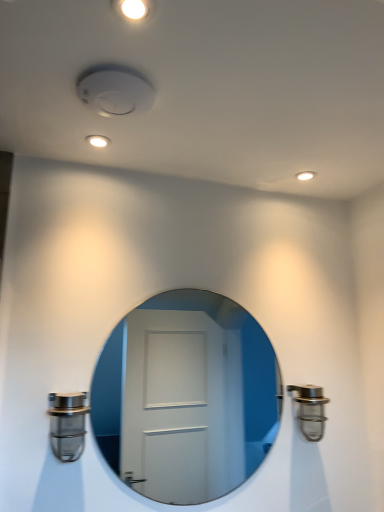
This screenshot has width=384, height=512. Describe the element at coordinates (67, 424) in the screenshot. I see `satin nickel door handle at lower left, the 1th door handle from the front` at that location.

Measure the distance between point (x=327, y=401) and camera.

The depth of point (x=327, y=401) is 5.28 feet.

The height and width of the screenshot is (512, 384). I want to click on satin nickel faucet at right, the second door handle positioned from the left, so click(x=310, y=410).

What do you see at coordinates (185, 397) in the screenshot? Image resolution: width=384 pixels, height=512 pixels. I see `white glossy mirror at center` at bounding box center [185, 397].

The width and height of the screenshot is (384, 512). Find the location of `satin nickel door handle at lower left, which is counted as the second door handle, starting from the right`. satin nickel door handle at lower left, which is counted as the second door handle, starting from the right is located at coordinates click(x=67, y=424).

Considering their positions, is satin nickel faucet at right, the 1th door handle viewed from the back, located in front of or behind white glossy mirror at center?

In the image, satin nickel faucet at right, the 1th door handle viewed from the back, appears behind white glossy mirror at center.

From the image's perspective, which one is positioned lower, satin nickel faucet at right, the second door handle in the front-to-back sequence, or white glossy mirror at center?

satin nickel faucet at right, the second door handle in the front-to-back sequence, from the image's perspective.

Is satin nickel faucet at right, the first door handle from the right, facing towards white glossy mirror at center?

No, satin nickel faucet at right, the first door handle from the right, does not turn towards white glossy mirror at center.

In terms of size, does satin nickel faucet at right, the second door handle in the front-to-back sequence, appear bigger or smaller than white glossy mirror at center?

In the image, satin nickel faucet at right, the second door handle in the front-to-back sequence, appears to be smaller than white glossy mirror at center.

Locate an element on the screen. door handle above the satin nickel faucet at right, the first door handle from the right (from a real-world perspective) is located at coordinates (67, 424).

Which is nearer, [301,403] or [72,394]?

Point [301,403] appears to be farther away from the viewer than point [72,394].

Does satin nickel faucet at right, the second door handle positioned from the left, have a lesser height compared to satin nickel door handle at lower left, arranged as the 2th door handle when viewed from the back?

In fact, satin nickel faucet at right, the second door handle positioned from the left, may be taller than satin nickel door handle at lower left, arranged as the 2th door handle when viewed from the back.

Is satin nickel faucet at right, the 1th door handle viewed from the back, looking in the opposite direction of satin nickel door handle at lower left, which is counted as the second door handle, starting from the right?

No, satin nickel door handle at lower left, which is counted as the second door handle, starting from the right, is not at the back of satin nickel faucet at right, the 1th door handle viewed from the back.

Are satin nickel door handle at lower left, the 1th door handle in the left-to-right sequence, and white glossy mirror at center far apart?

Yes, satin nickel door handle at lower left, the 1th door handle in the left-to-right sequence, and white glossy mirror at center are located far from each other.

Considering the positions of objects satin nickel door handle at lower left, the 1th door handle in the left-to-right sequence, and white glossy mirror at center in the image provided, who is more to the right, satin nickel door handle at lower left, the 1th door handle in the left-to-right sequence, or white glossy mirror at center?

white glossy mirror at center.

Is satin nickel door handle at lower left, arranged as the 2th door handle when viewed from the back, turned away from white glossy mirror at center?

No.

From the image's perspective, which object appears higher, satin nickel door handle at lower left, arranged as the 2th door handle when viewed from the back, or white glossy mirror at center?

white glossy mirror at center, from the image's perspective.

Does white glossy mirror at center lie in front of satin nickel door handle at lower left, the 1th door handle from the front?

No, it is not.

Between white glossy mirror at center and satin nickel door handle at lower left, the 1th door handle in the left-to-right sequence, which one appears on the right side from the viewer's perspective?

white glossy mirror at center.

Could you tell me if white glossy mirror at center is turned towards satin nickel door handle at lower left, the 1th door handle in the left-to-right sequence?

No, white glossy mirror at center does not turn towards satin nickel door handle at lower left, the 1th door handle in the left-to-right sequence.

What's the angular difference between white glossy mirror at center and satin nickel door handle at lower left, which is counted as the second door handle, starting from the right,'s facing directions?

0.792 degrees separate the facing orientations of white glossy mirror at center and satin nickel door handle at lower left, which is counted as the second door handle, starting from the right.

Choose the correct answer: Is white glossy mirror at center inside satin nickel faucet at right, the 1th door handle viewed from the back, or outside it?

white glossy mirror at center exists outside the volume of satin nickel faucet at right, the 1th door handle viewed from the back.

How much distance is there between white glossy mirror at center and satin nickel faucet at right, the first door handle from the right?

white glossy mirror at center is 1.54 meters from satin nickel faucet at right, the first door handle from the right.

Considering the relative positions of white glossy mirror at center and satin nickel faucet at right, the second door handle in the front-to-back sequence, in the image provided, is white glossy mirror at center to the right of satin nickel faucet at right, the second door handle in the front-to-back sequence, from the viewer's perspective?

Incorrect, white glossy mirror at center is not on the right side of satin nickel faucet at right, the second door handle in the front-to-back sequence.

From the image's perspective, between white glossy mirror at center and satin nickel faucet at right, the second door handle in the front-to-back sequence, who is located below?

satin nickel faucet at right, the second door handle in the front-to-back sequence.

Is satin nickel door handle at lower left, which is counted as the second door handle, starting from the right, further to the viewer compared to satin nickel faucet at right, the 1th door handle viewed from the back?

No, satin nickel door handle at lower left, which is counted as the second door handle, starting from the right, is closer to the viewer.

From the image's perspective, is satin nickel door handle at lower left, arranged as the 2th door handle when viewed from the back, located above or below satin nickel faucet at right, the 1th door handle viewed from the back?

Based on their image positions, satin nickel door handle at lower left, arranged as the 2th door handle when viewed from the back, is located above satin nickel faucet at right, the 1th door handle viewed from the back.

Measure the distance from satin nickel door handle at lower left, which is counted as the second door handle, starting from the right, to satin nickel faucet at right, the second door handle positioned from the left.

The distance of satin nickel door handle at lower left, which is counted as the second door handle, starting from the right, from satin nickel faucet at right, the second door handle positioned from the left, is 31.08 inches.

From a real-world perspective, starting from the white glossy mirror at center, which door handle is the 2nd one below it? Please provide its 2D coordinates.

[(310, 410)]

What are the coordinates of `door handle below the satin nickel door handle at lower left, the 1th door handle in the left-to-right sequence (from the image's perspective)` in the screenshot? It's located at (310, 410).

In the scene shown: Considering their positions, is satin nickel door handle at lower left, which is counted as the second door handle, starting from the right, positioned closer to white glossy mirror at center than satin nickel faucet at right, the first door handle from the right?

Among the two, satin nickel faucet at right, the first door handle from the right, is located nearer to white glossy mirror at center.

Which object lies nearer to the anchor point satin nickel faucet at right, the second door handle positioned from the left, satin nickel door handle at lower left, arranged as the 2th door handle when viewed from the back, or white glossy mirror at center?

Among the two, satin nickel door handle at lower left, arranged as the 2th door handle when viewed from the back, is located nearer to satin nickel faucet at right, the second door handle positioned from the left.

From the image, which object appears to be nearer to satin nickel faucet at right, the second door handle positioned from the left, white glossy mirror at center or satin nickel door handle at lower left, the 1th door handle in the left-to-right sequence?

satin nickel door handle at lower left, the 1th door handle in the left-to-right sequence, lies closer to satin nickel faucet at right, the second door handle positioned from the left, than the other object.

Based on their spatial positions, is satin nickel faucet at right, the first door handle from the right, or satin nickel door handle at lower left, the 1th door handle in the left-to-right sequence, further from white glossy mirror at center?

The object further to white glossy mirror at center is satin nickel door handle at lower left, the 1th door handle in the left-to-right sequence.

Estimate the real-world distances between objects in this image. Which object is further from satin nickel door handle at lower left, arranged as the 2th door handle when viewed from the back, white glossy mirror at center or satin nickel faucet at right, the 1th door handle viewed from the back?

white glossy mirror at center.

From the image, which object appears to be nearer to satin nickel door handle at lower left, the 1th door handle in the left-to-right sequence, satin nickel faucet at right, the 1th door handle viewed from the back, or white glossy mirror at center?

Among the two, satin nickel faucet at right, the 1th door handle viewed from the back, is located nearer to satin nickel door handle at lower left, the 1th door handle in the left-to-right sequence.

Where is `mirror between satin nickel door handle at lower left, which is counted as the second door handle, starting from the right, and satin nickel faucet at right, the second door handle positioned from the left, from left to right`? The height and width of the screenshot is (512, 384). mirror between satin nickel door handle at lower left, which is counted as the second door handle, starting from the right, and satin nickel faucet at right, the second door handle positioned from the left, from left to right is located at coordinates (185, 397).